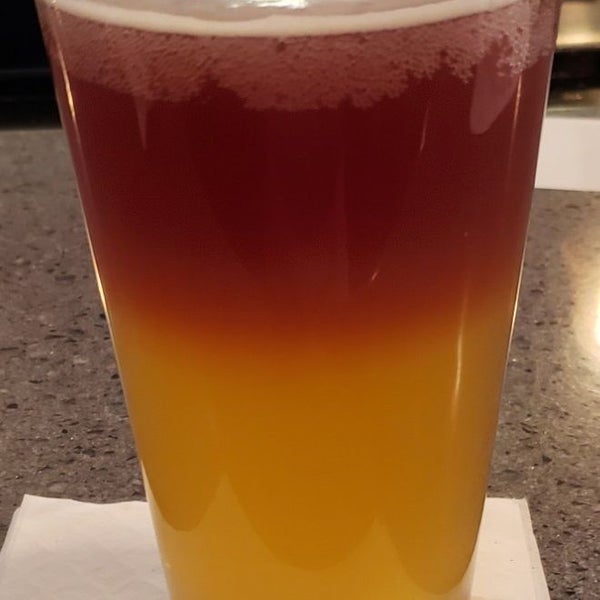
Find the location of `white napkin`. white napkin is located at coordinates (87, 538).